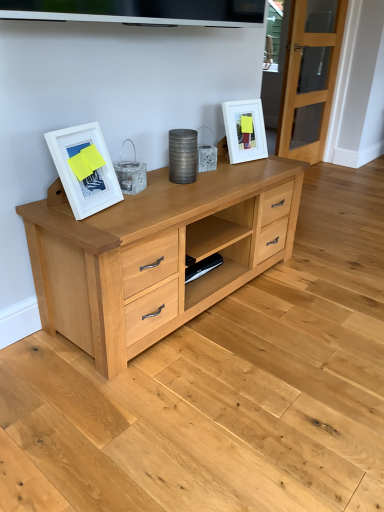
Question: Is clear glass door at right not close to white matte picture frame at upper right, the 2th picture frame when ordered from front to back?

Choices:
 (A) no
 (B) yes

Answer: (B)

Question: Is clear glass door at right beside white matte picture frame at upper right, which is counted as the 1th picture frame, starting from the back?

Choices:
 (A) yes
 (B) no

Answer: (B)

Question: From a real-world perspective, is clear glass door at right positioned over white matte picture frame at upper right, the 2th picture frame when ordered from front to back, based on gravity?

Choices:
 (A) yes
 (B) no

Answer: (A)

Question: Considering the relative sizes of clear glass door at right and white matte picture frame at upper right, which is counted as the 1th picture frame, starting from the back, in the image provided, is clear glass door at right taller than white matte picture frame at upper right, which is counted as the 1th picture frame, starting from the back,?

Choices:
 (A) yes
 (B) no

Answer: (A)

Question: Does clear glass door at right have a lesser width compared to white matte picture frame at upper right, which is the 2th picture frame in bottom-to-top order?

Choices:
 (A) yes
 (B) no

Answer: (B)

Question: In the image, is white matte picture frame at left, which is counted as the second picture frame, starting from the right, positioned in front of or behind clear glass door at right?

Choices:
 (A) behind
 (B) front

Answer: (B)

Question: Is white matte picture frame at left, the first picture frame positioned from the left, taller or shorter than clear glass door at right?

Choices:
 (A) tall
 (B) short

Answer: (B)

Question: From a real-world perspective, is white matte picture frame at left, the 1th picture frame positioned from the bottom, above or below clear glass door at right?

Choices:
 (A) above
 (B) below

Answer: (B)

Question: Is white matte picture frame at left, which appears as the 2th picture frame when viewed from the top, bigger or smaller than clear glass door at right?

Choices:
 (A) small
 (B) big

Answer: (A)

Question: Considering the positions of white matte picture frame at upper right, which is the 2th picture frame in bottom-to-top order, and clear glass door at right in the image, is white matte picture frame at upper right, which is the 2th picture frame in bottom-to-top order, taller or shorter than clear glass door at right?

Choices:
 (A) tall
 (B) short

Answer: (B)

Question: Is white matte picture frame at upper right, which appears as the first picture frame when viewed from the right, to the left or to the right of clear glass door at right in the image?

Choices:
 (A) right
 (B) left

Answer: (B)

Question: In terms of size, does white matte picture frame at upper right, which appears as the 1th picture frame when viewed from the top, appear bigger or smaller than clear glass door at right?

Choices:
 (A) big
 (B) small

Answer: (B)

Question: Considering their positions, is white matte picture frame at upper right, acting as the 2th picture frame starting from the left, located in front of or behind clear glass door at right?

Choices:
 (A) behind
 (B) front

Answer: (B)

Question: Considering the positions of point (256, 136) and point (72, 176), is point (256, 136) closer or farther from the camera than point (72, 176)?

Choices:
 (A) farther
 (B) closer

Answer: (A)

Question: Visually, is white matte picture frame at upper right, which is the 2th picture frame in bottom-to-top order, positioned to the left or to the right of white matte picture frame at left, the 1th picture frame positioned from the bottom?

Choices:
 (A) right
 (B) left

Answer: (A)